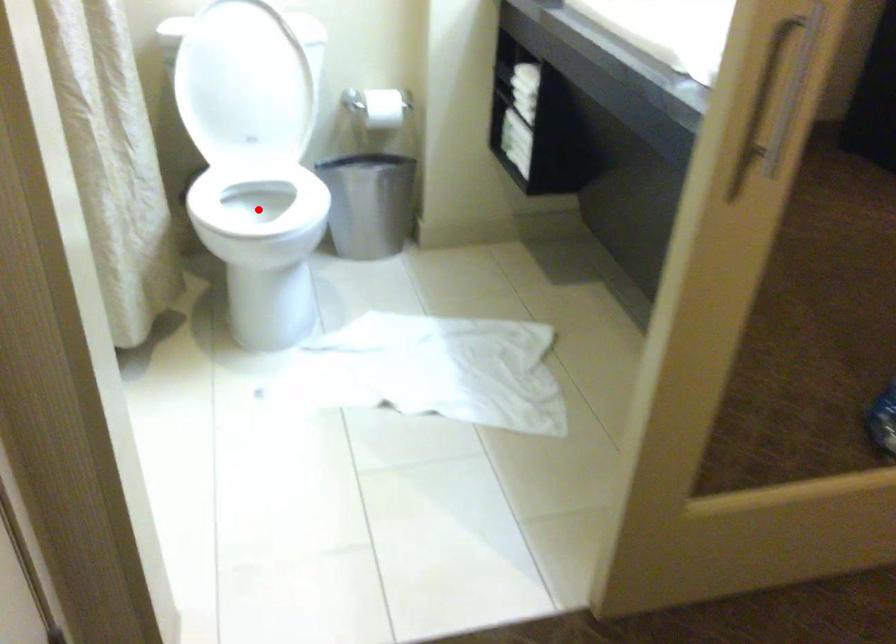
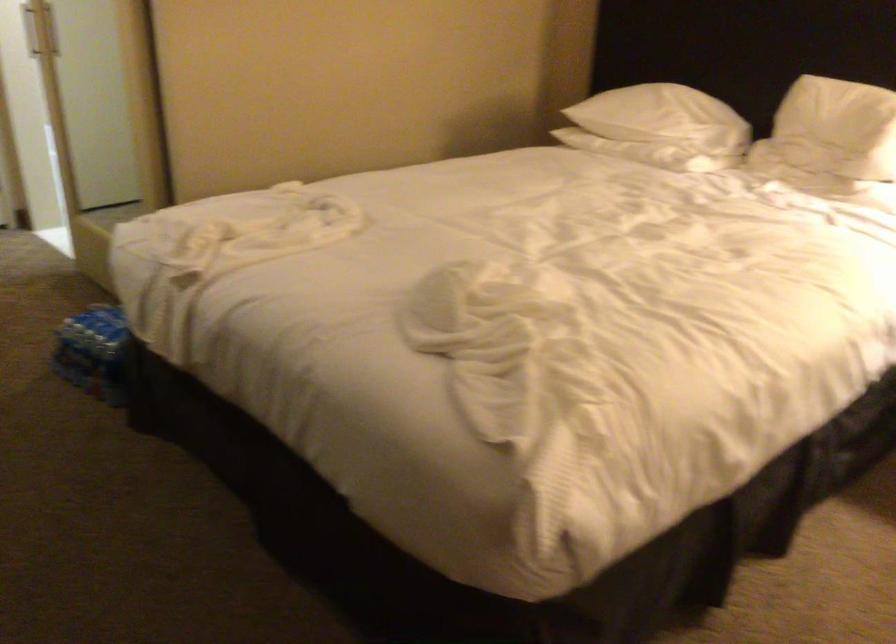
Question: I am providing you with two images of the same scene from different viewpoints. A red point is marked on the first image. Can you still see the location of the red point in image 2?

Choices:
 (A) Yes
 (B) No

Answer: (B)